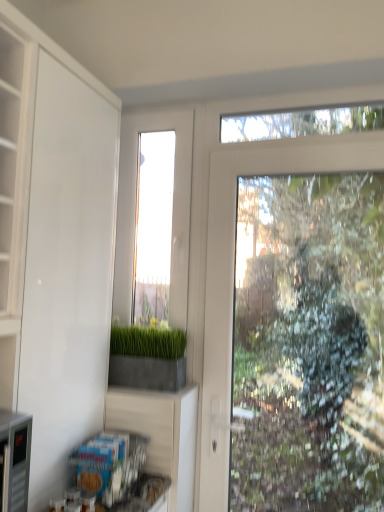
Question: Can you confirm if clear glass window at center is smaller than white matte cabinet at left?

Choices:
 (A) yes
 (B) no

Answer: (A)

Question: Is the depth of clear glass window at center greater than that of white matte cabinet at left?

Choices:
 (A) yes
 (B) no

Answer: (A)

Question: From the image's perspective, would you say clear glass window at center is positioned over white matte cabinet at left?

Choices:
 (A) no
 (B) yes

Answer: (B)

Question: Is clear glass window at center at the left side of white matte cabinet at left?

Choices:
 (A) yes
 (B) no

Answer: (B)

Question: Considering the relative sizes of clear glass window at center and white matte cabinet at left in the image provided, is clear glass window at center thinner than white matte cabinet at left?

Choices:
 (A) no
 (B) yes

Answer: (B)

Question: Does clear glass window at center have a lesser height compared to white matte cabinet at left?

Choices:
 (A) no
 (B) yes

Answer: (B)

Question: From the image's perspective, does white matte cabinet at left appear higher than concrete planter at center?

Choices:
 (A) no
 (B) yes

Answer: (B)

Question: From a real-world perspective, is white matte cabinet at left located higher than concrete planter at center?

Choices:
 (A) no
 (B) yes

Answer: (B)

Question: Is white matte cabinet at left positioned with its back to concrete planter at center?

Choices:
 (A) no
 (B) yes

Answer: (A)

Question: Can we say white matte cabinet at left lies outside concrete planter at center?

Choices:
 (A) no
 (B) yes

Answer: (B)

Question: Is concrete planter at center inside white matte cabinet at left?

Choices:
 (A) yes
 (B) no

Answer: (B)

Question: Could you tell me if white matte cabinet at left is facing concrete planter at center?

Choices:
 (A) no
 (B) yes

Answer: (A)

Question: Is concrete planter at center directly adjacent to white matte cabinet at left?

Choices:
 (A) no
 (B) yes

Answer: (A)